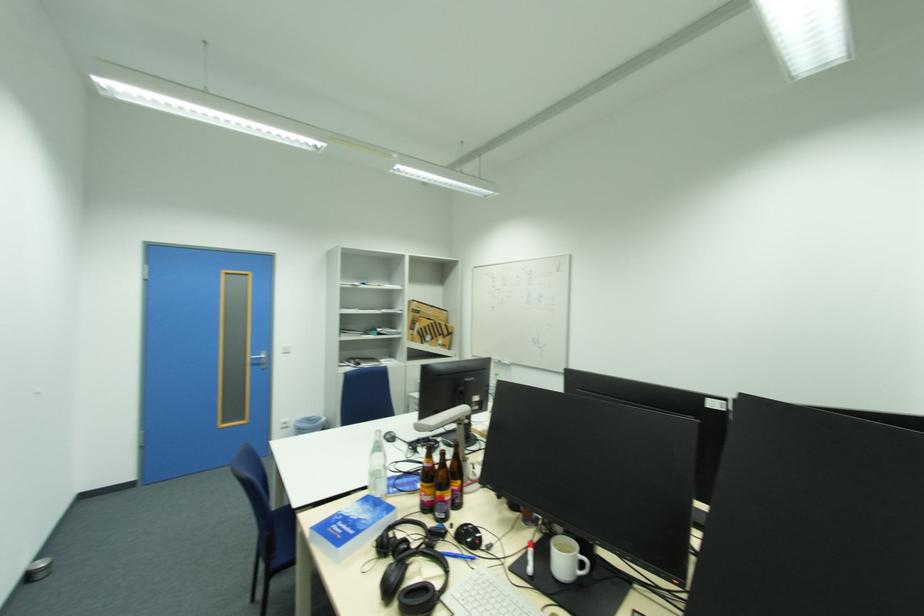
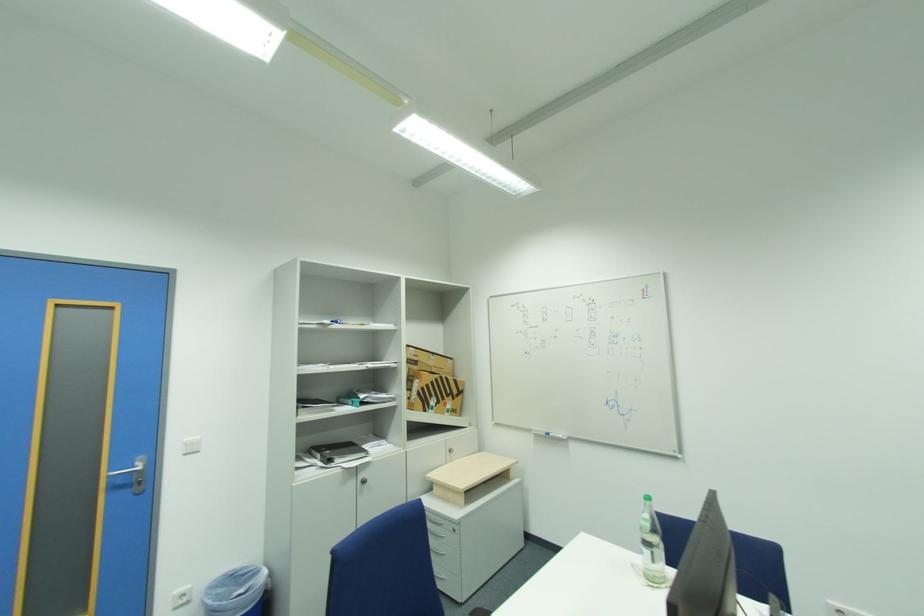
In a continuous first-person perspective shot, in which direction is the camera moving?

The cameraman walked toward left, forward.